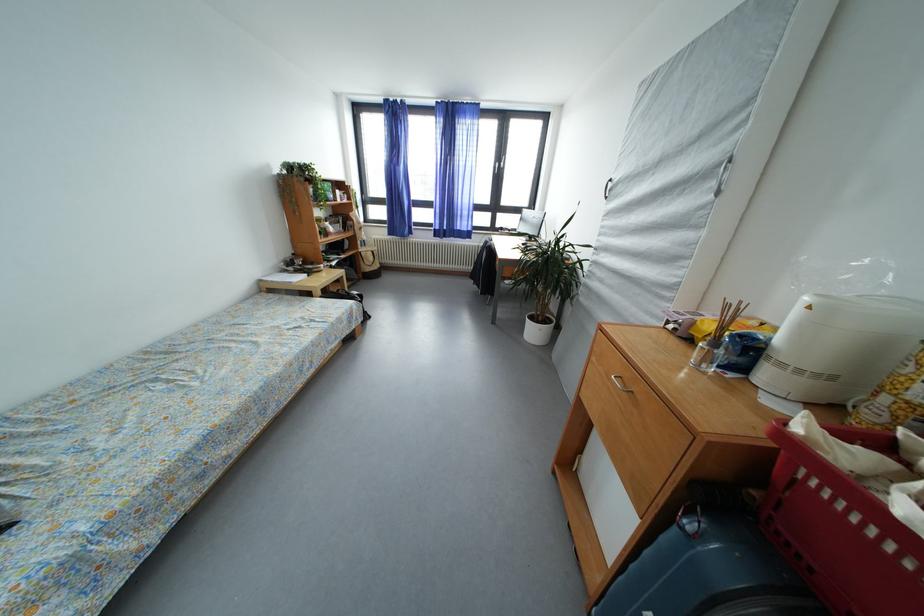
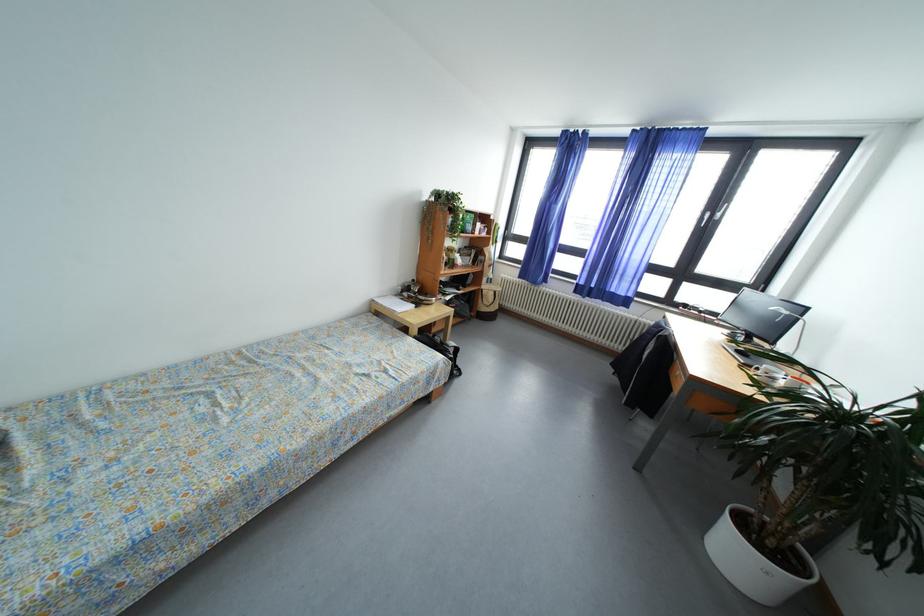
In the second image, find the point that corresponds to pixel 293 280 in the first image.

(405, 305)